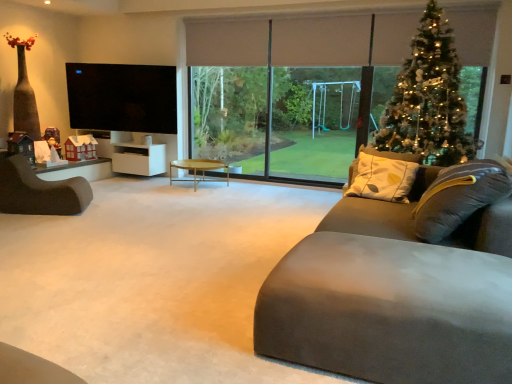
Question: Is transparent glass window at center to the left or to the right of dark brown leather chair at left in the image?

Choices:
 (A) left
 (B) right

Answer: (B)

Question: Looking at their shapes, would you say transparent glass window at center is wider or thinner than dark brown leather chair at left?

Choices:
 (A) wide
 (B) thin

Answer: (B)

Question: Which is farther from the transparent glass window at center?

Choices:
 (A) dark brown leather chair at left
 (B) suede-like gray couch at lower right
 (C) iridescent metallic christmas tree at upper right
 (D) wooden round coffee table at center
 (E) white glossy table at left

Answer: (B)

Question: Considering the real-world distances, which object is closest to the black glossy flat-screen tv at upper left?

Choices:
 (A) transparent glass window at center
 (B) iridescent metallic christmas tree at upper right
 (C) dark brown leather chair at left
 (D) white matte cabinet at left
 (E) white glossy table at left

Answer: (D)